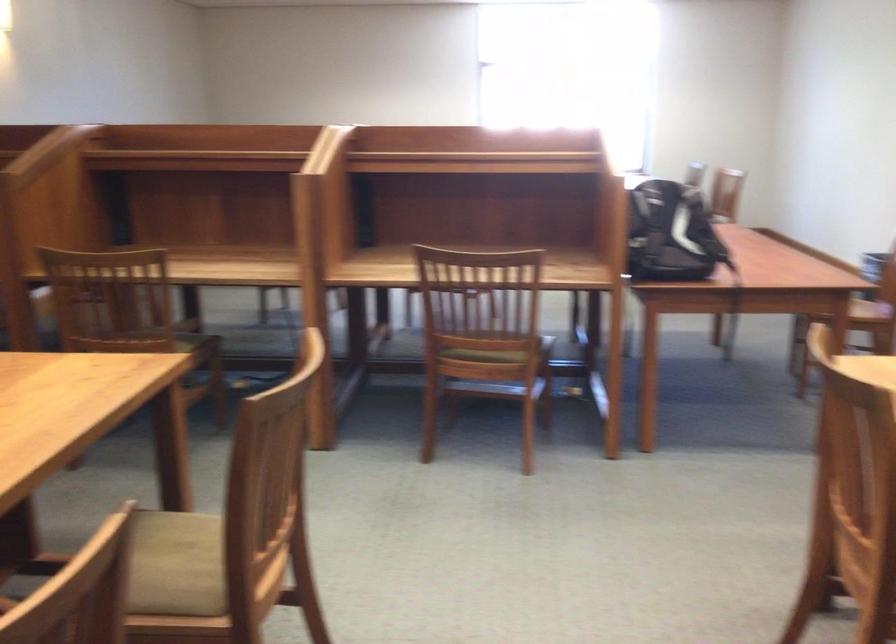
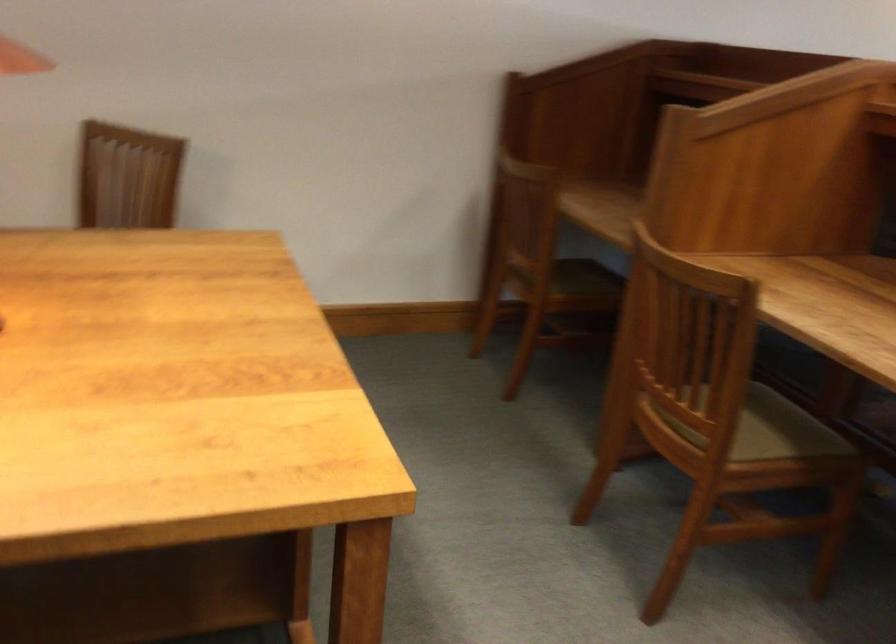
The point at (167, 339) is marked in the first image. Where is the corresponding point in the second image?

(765, 428)